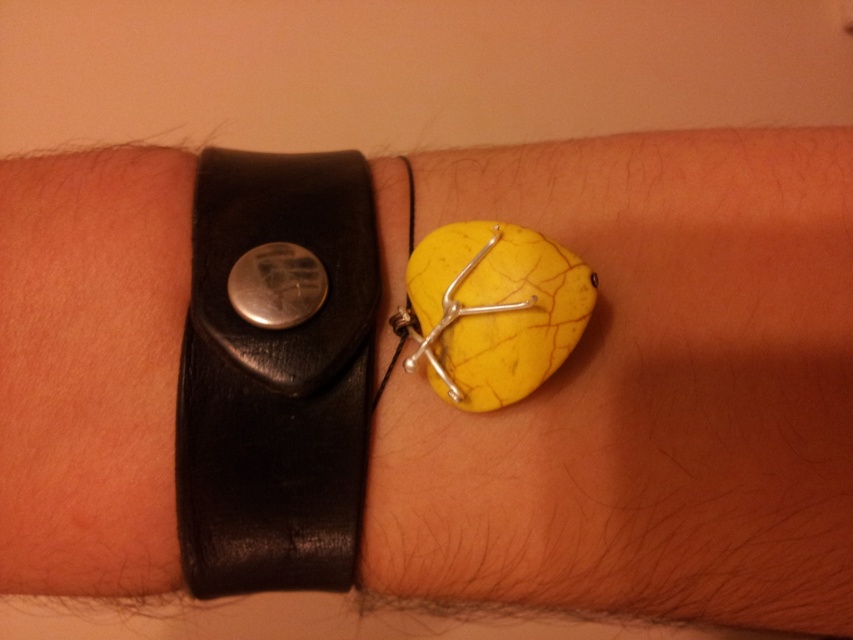
You are a jeweler trying to determine if a new bracelet will fit between the existing black leather watch at left and the metallic yellow ring at center on the wrist. The new bracelet is 3 cm wide. Can it fit without overlapping either item?

The black leather watch at left might be wider than metallic yellow ring at center, so the total width available between them is uncertain. Without knowing the exact widths, it is impossible to confirm if the 3 cm wide bracelet will fit without overlapping.

Consider the image. You are a jeweler examining the bracelets on the wrist. You need to remove the metallic yellow ring at center first. Can you remove it without moving the black leather watch at left?

The metallic yellow ring at center is behind the black leather watch at left, so you can remove the metallic yellow ring at center first without moving the black leather watch at left.